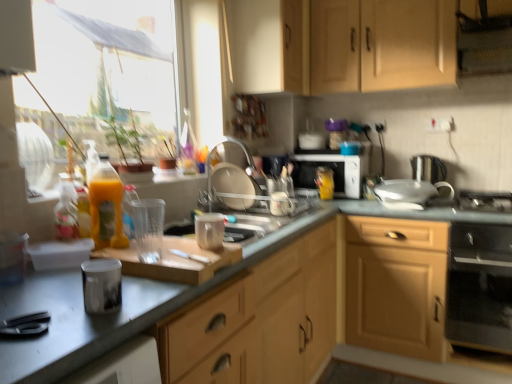
Question: Looking at the image, does translucent yellow bottle at left seem bigger or smaller compared to transparent plastic glass at center, positioned as the 2th appliance in front-to-back order?

Choices:
 (A) big
 (B) small

Answer: (A)

Question: Is translucent yellow bottle at left to the left or to the right of transparent plastic glass at center, positioned as the 2th appliance in front-to-back order, in the image?

Choices:
 (A) left
 (B) right

Answer: (A)

Question: Based on their relative distances, which object is farther from the translucent yellow bottle at left?

Choices:
 (A) matte white cup at center, the third appliance from the front
 (B) white glossy sink at center, positioned as the 7th appliance in left-to-right order
 (C) light wood cabinet at lower right, which is the 1th cabinetry in bottom-to-top order
 (D) transparent glass window at upper left
 (E) black matte gas stove at right

Answer: (E)

Question: Which is nearer to the black matte gas stove at right?

Choices:
 (A) translucent yellow bottle at left
 (B) clear plastic dish rack at center, acting as the fourth appliance starting from the back
 (C) light wood cabinet at lower right, positioned as the 3th cabinetry in top-to-bottom order
 (D) matte white cup at center, placed as the fourth appliance when sorted from left to right
 (E) transparent glass window at upper left

Answer: (C)